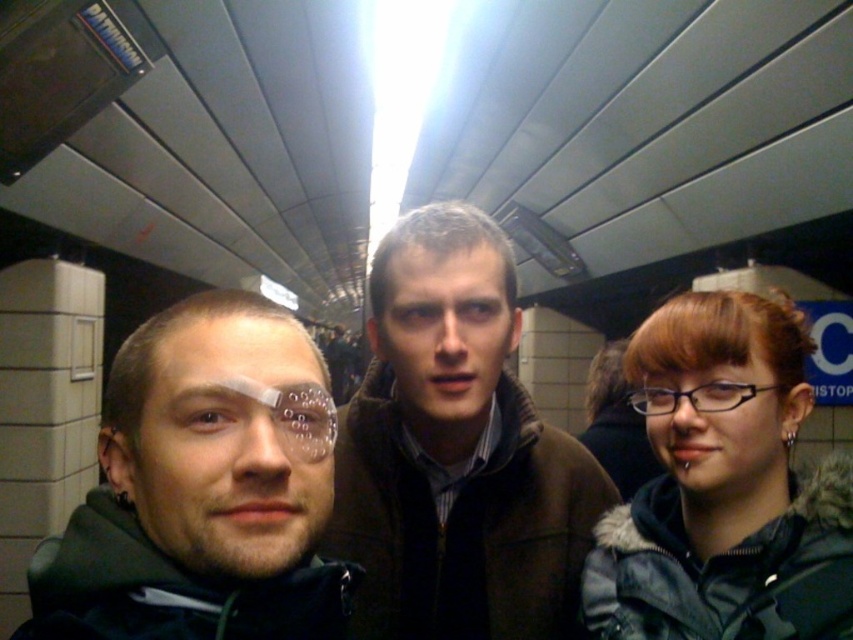
You are standing at the entrance of the subway station and want to locate the dark green jacket at left. According to the coordinate system where the bottom left corner is the origin, which quadrant would you find it in?

The dark green jacket at left is located at coordinate point (202, 488). Since the x and y coordinates are both above 0.5, it falls in the first quadrant.

You are a delivery robot in a subway station. You need to deliver a package to the person wearing the brown fuzzy jacket at center. The coordinates of the jacket are at point 0.706, 0.536. If you are currently at point 0.5, 0.5, which direction should you move to reach the jacket?

The brown fuzzy jacket at center is located at coordinates (456,451). Since you are at (426,320), you should move northeast to reach the jacket.